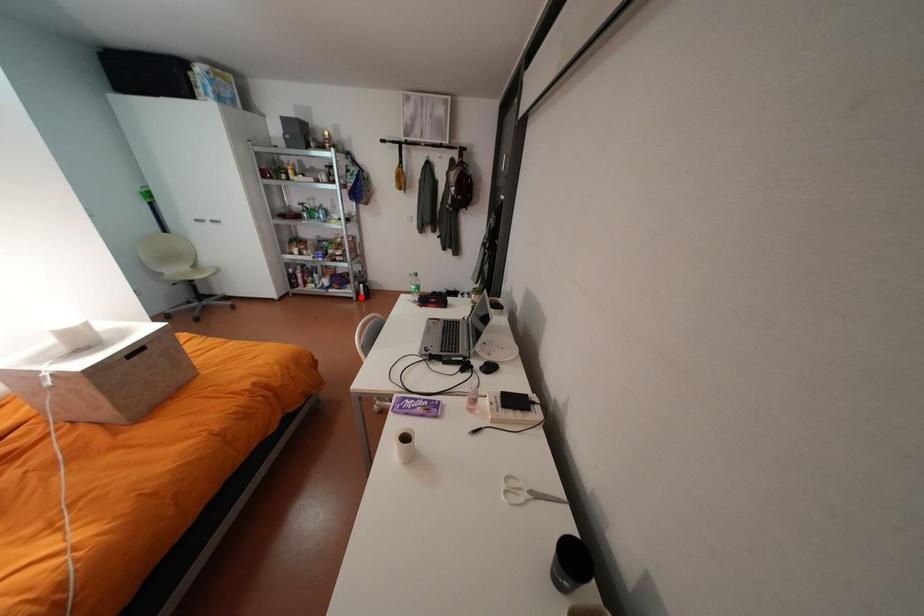
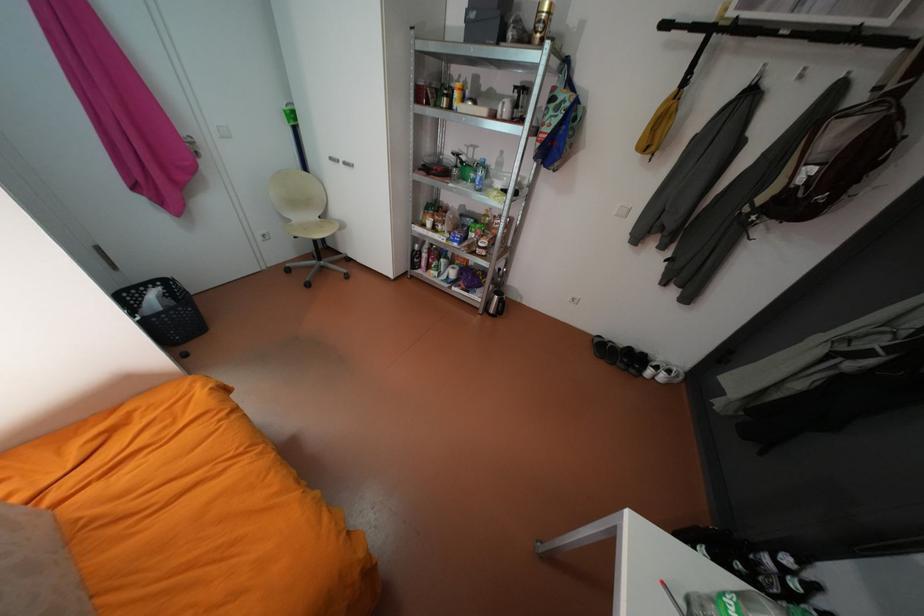
The point at the highlighted location is marked in the first image. Where is the corresponding point in the second image?

(487, 308)